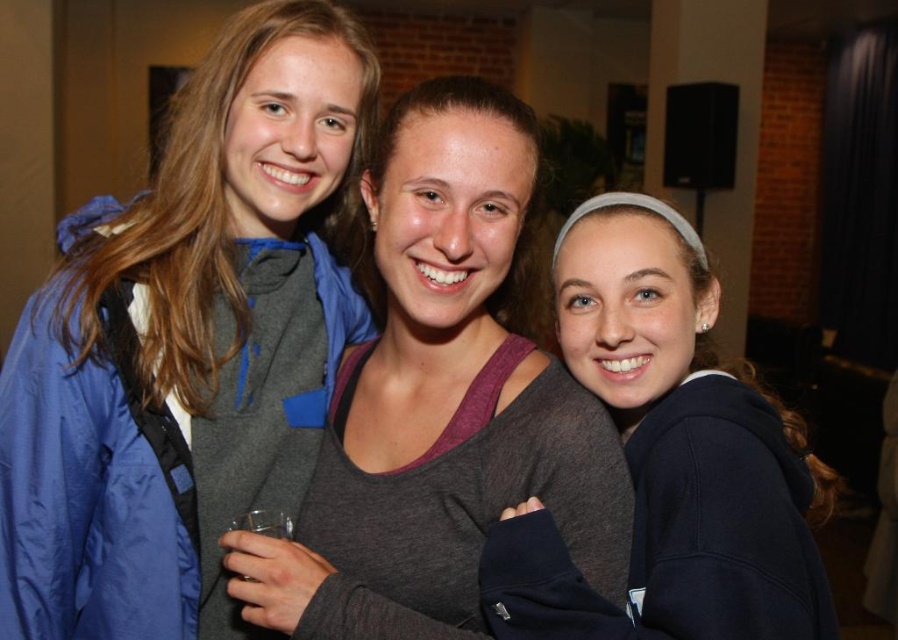
How far apart are matte gray hoodie at center and gray matte tank top at center?

The distance of matte gray hoodie at center from gray matte tank top at center is 8.00 inches.

Does point (190, 323) come behind point (509, 358)?

Yes.

The image size is (898, 640). Find the location of `matte gray hoodie at center`. matte gray hoodie at center is located at coordinates (188, 342).

I want to click on matte gray hoodie at center, so click(x=188, y=342).

Between matte gray hoodie at center and dark blue sweatshirt at center, which one is positioned lower?

dark blue sweatshirt at center is lower down.

At what (x,y) coordinates should I click in order to perform the action: click on matte gray hoodie at center. Please return your answer as a coordinate pair (x, y). Looking at the image, I should click on (188, 342).

Does point (317, 339) come behind point (813, 572)?

That is True.

Where is `matte gray hoodie at center`? This screenshot has height=640, width=898. matte gray hoodie at center is located at coordinates (188, 342).

Is gray matte tank top at center bigger than dark blue sweatshirt at center?

No.

Which is in front, point (533, 179) or point (667, 490)?

Positioned in front is point (667, 490).

The height and width of the screenshot is (640, 898). Find the location of `gray matte tank top at center`. gray matte tank top at center is located at coordinates click(x=439, y=403).